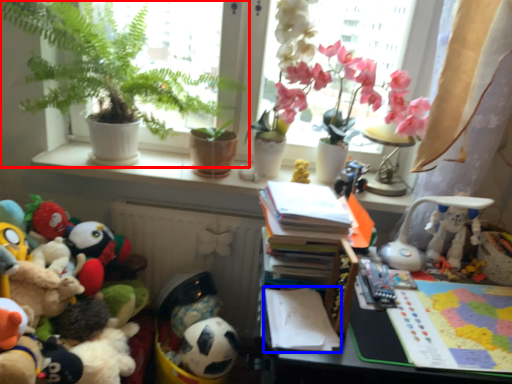
Question: Which object is further to the camera taking this photo, houseplant (highlighted by a red box) or notepad (highlighted by a blue box)?

Choices:
 (A) houseplant
 (B) notepad

Answer: (A)